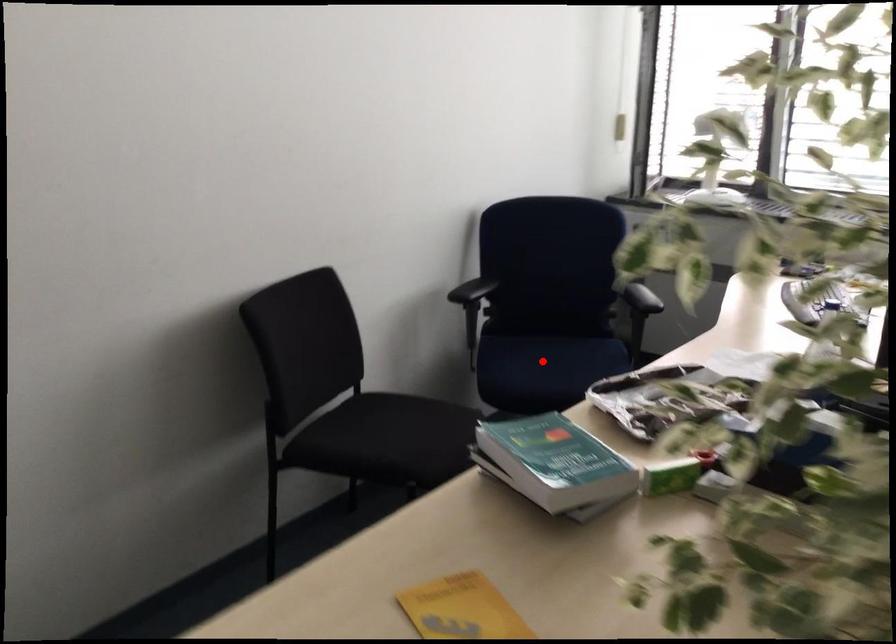
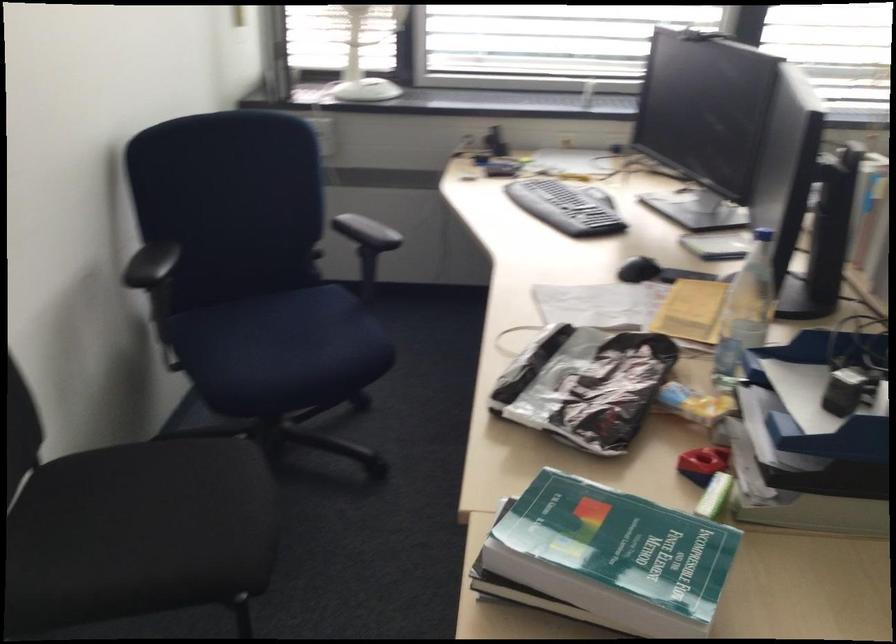
Question: I am providing you with two images of the same scene from different viewpoints. Given a red point in image1, look at the same physical point in image2. Is it:

Choices:
 (A) Closer to the viewpoint
 (B) Farther from the viewpoint

Answer: (A)